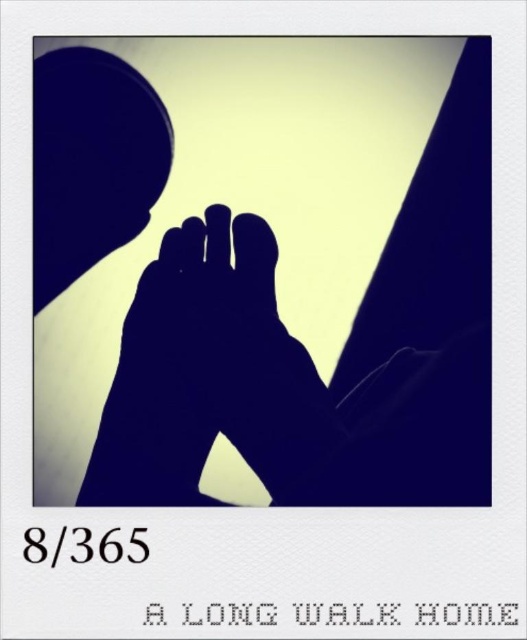
Does black matte feet at center have a greater width compared to black matte hand at center?

Yes.

The height and width of the screenshot is (640, 527). What do you see at coordinates (278, 280) in the screenshot?
I see `black matte feet at center` at bounding box center [278, 280].

Which is in front, point (483, 49) or point (328, 451)?

Point (328, 451) is more forward.

Identify the location of black matte feet at center. Image resolution: width=527 pixels, height=640 pixels. (278, 280).